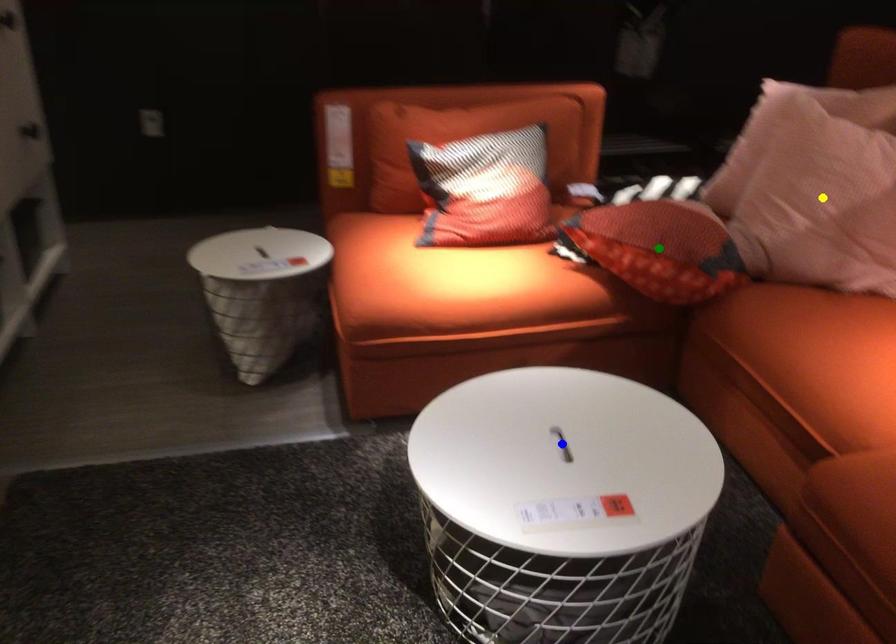
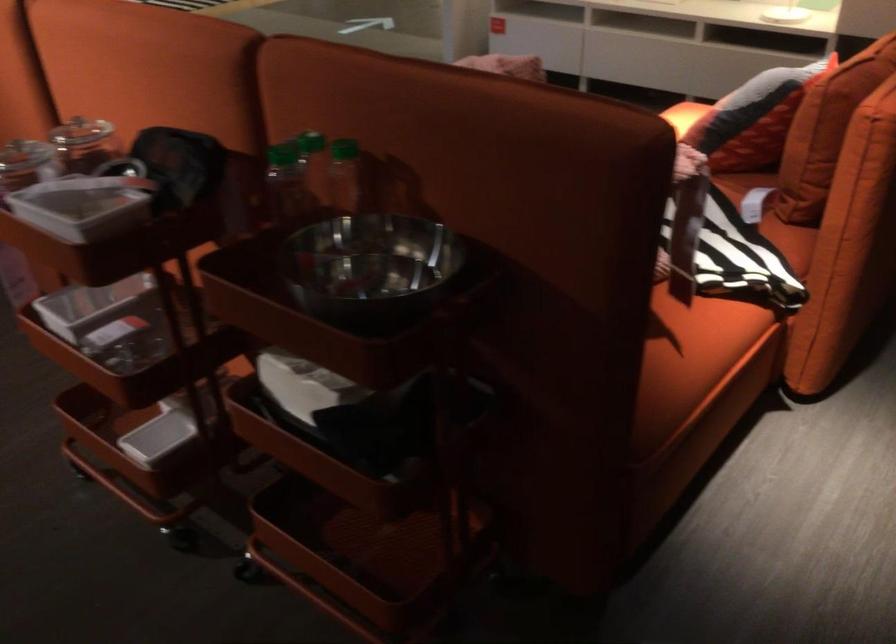
I am providing you with two images of the same scene from different viewpoints. Three points are marked in image1. Which point corresponds to a part or object that is occluded in image2?In image1, three points are marked. Which of them correspond to a part or object that is occluded in image2?Among the three points shown in image1, which one corresponds to a part or object that is no longer visible due to occlusion in image2?

yellow point, blue point, green point